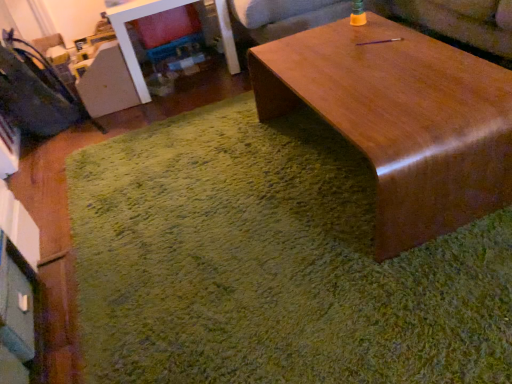
You are a GUI agent. You are given a task and a screenshot of the screen. Output one action in this format:
    pyautogui.click(x=<x>, y=<y>)
    Task: Click on the vacant point above green shaggy rug at center (from a real-world perspective)
    Image resolution: width=512 pixels, height=384 pixels.
    Given the screenshot: What is the action you would take?
    pyautogui.click(x=261, y=210)